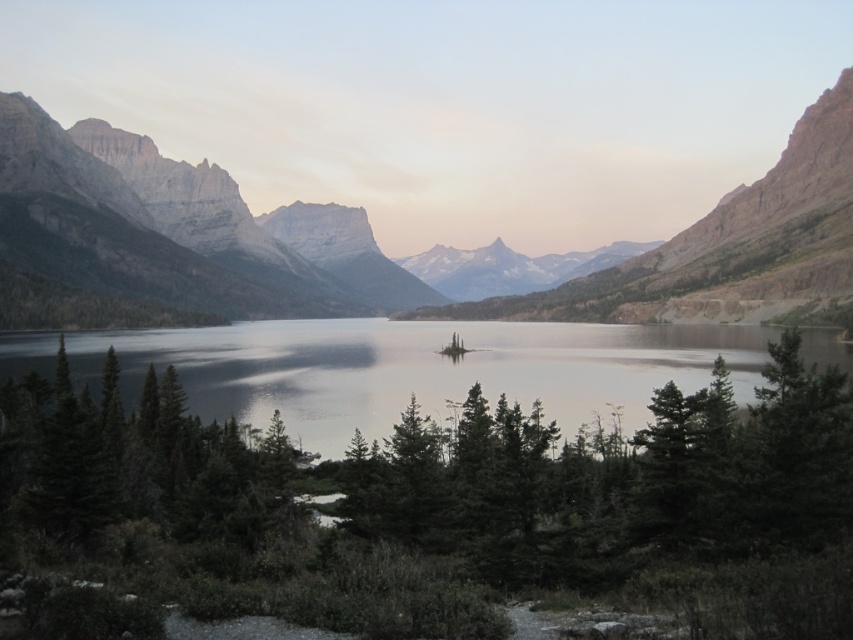
Question: Which is farther from the matte gray rock at center?

Choices:
 (A) green matte tree at center
 (B) clear water at center

Answer: (A)

Question: Does green matte tree at center appear over clear water at center?

Choices:
 (A) no
 (B) yes

Answer: (A)

Question: Which of the following is the farthest from the observer?

Choices:
 (A) matte gray rock at center
 (B) green matte tree at center

Answer: (A)

Question: Based on their relative distances, which object is nearer to the matte gray rock at center?

Choices:
 (A) green matte tree at center
 (B) clear water at center

Answer: (B)

Question: In this image, where is green matte tree at center located relative to matte gray rock at center?

Choices:
 (A) left
 (B) right

Answer: (B)

Question: Does green matte tree at center appear on the right side of clear water at center?

Choices:
 (A) no
 (B) yes

Answer: (B)